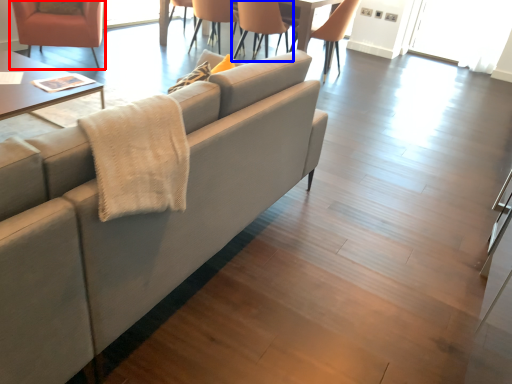
Question: Which object appears closest to the camera in this image, chair (highlighted by a red box) or chair (highlighted by a blue box)?

Choices:
 (A) chair
 (B) chair

Answer: (A)